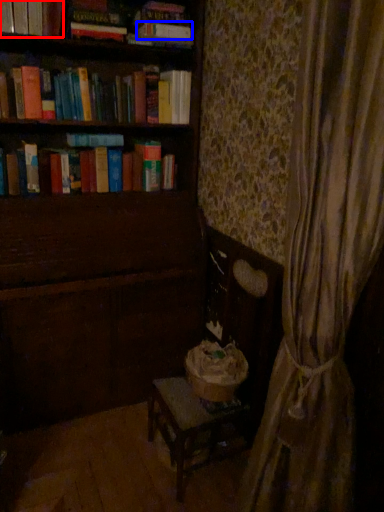
Question: Which of the following is the farthest to the observer, book (highlighted by a red box) or paperback book (highlighted by a blue box)?

Choices:
 (A) book
 (B) paperback book

Answer: (B)